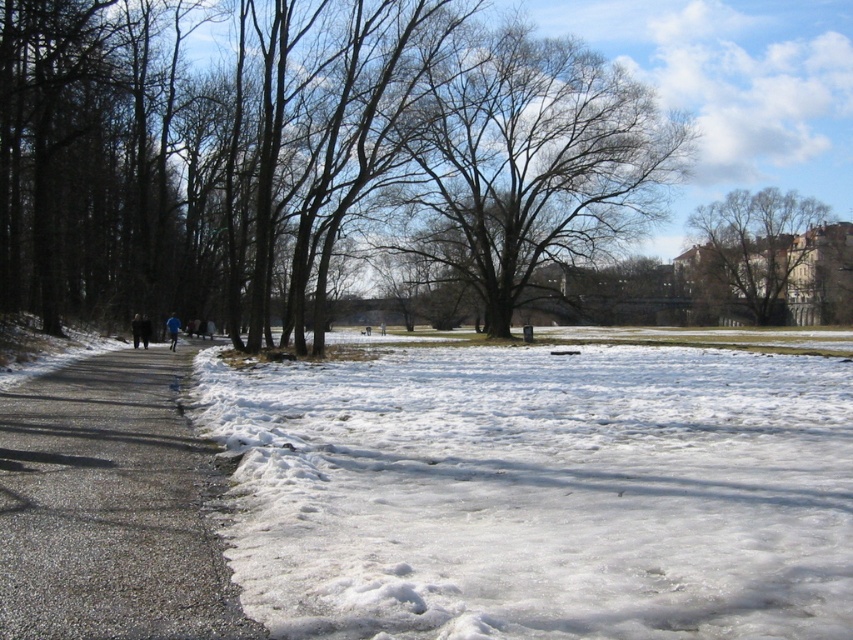
Question: Among these points, which one is farthest from the camera?

Choices:
 (A) (538, 131)
 (B) (161, 417)
 (C) (726, 529)

Answer: (A)

Question: Which object appears farthest from the camera in this image?

Choices:
 (A) white fluffy snow at lower right
 (B) bare branches at center

Answer: (B)

Question: Does white fluffy snow at lower right appear on the left side of asphalt road at left?

Choices:
 (A) yes
 (B) no

Answer: (B)

Question: Does green leafy tree at upper right have a lesser width compared to dark blue jacket at left?

Choices:
 (A) yes
 (B) no

Answer: (B)

Question: Based on their relative distances, which object is nearer to the asphalt road at left?

Choices:
 (A) dark blue jacket at left
 (B) white fluffy snow at lower right
 (C) green leafy tree at upper right
 (D) bare branches at center

Answer: (B)

Question: In this image, where is bare branches at center located relative to green leafy tree at upper right?

Choices:
 (A) left
 (B) right

Answer: (A)